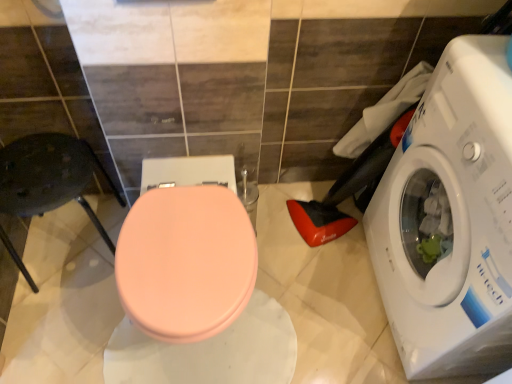
I want to click on free space above matte pink lid at center (from a real-world perspective), so click(x=185, y=249).